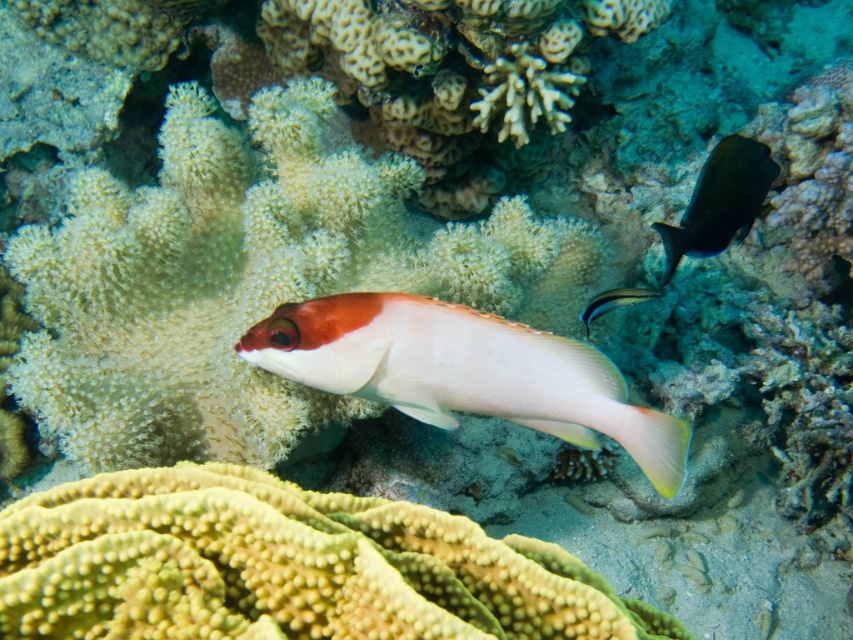
Looking at this image, you are a marine biologist studying underwater ecosystems. You observe the shiny black fish at upper right in the image. What are its coordinates in the 2D plane?

The shiny black fish at upper right is located at coordinates (720, 200) in the 2D plane.

You are a marine biologist observing the underwater scene. You notice two fish species in the image. The shiny black fish at upper right and the shiny silver fish at center. Which fish has a greater width?

The shiny black fish at upper right has a greater width than the shiny silver fish at center.

You are a marine biologist observing the underwater scene. You notice two points marked in the image. The first point is at coordinates point (352, 323), and the second point is at coordinates point (751, 152). Which of these two points is closer to the observer?

Point (352, 323) is in front of point (751, 152), so it is closer to the observer.